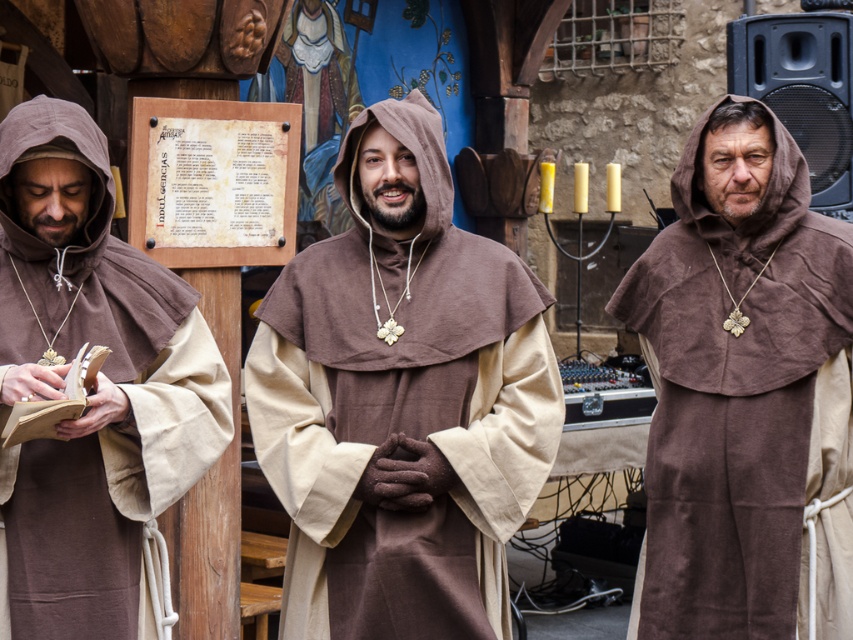
Question: Which object is closer to the camera taking this photo?

Choices:
 (A) brown cotton robe at left
 (B) brown linen robe at right

Answer: (A)

Question: Is brown cotton robe at center smaller than brown cotton robe at left?

Choices:
 (A) no
 (B) yes

Answer: (A)

Question: Does brown linen robe at right lie behind brown cotton robe at left?

Choices:
 (A) no
 (B) yes

Answer: (B)

Question: Which object is the closest to the brown linen robe at right?

Choices:
 (A) brown cotton robe at center
 (B) brown cotton robe at left

Answer: (A)

Question: Where is brown cotton robe at center located in relation to brown cotton robe at left in the image?

Choices:
 (A) below
 (B) above

Answer: (A)

Question: Which point is farther to the camera?

Choices:
 (A) brown linen robe at right
 (B) brown cotton robe at left
 (C) brown cotton robe at center

Answer: (A)